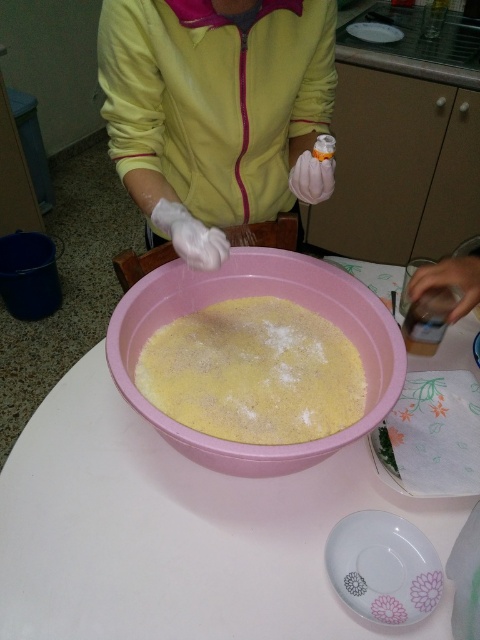
You are trying to place a small plate on the white plastic table at center. However, there is a pink plastic bowl at center in the way. Can you move the plate to the table without disturbing the bowl?

The white plastic table at center is below the pink plastic bowl at center, so you cannot place the plate on the table without moving the bowl first.

You are a food delivery robot with a height of 1.8 meters. You need to pick up an item from the kitchen counter. The porcelain plate at lower center and the white glossy plate at upper center are on the counter. Will your height interfere with reaching both plates?

The distance between the porcelain plate at lower center and the white glossy plate at upper center is 1.79 meters. Since your height is 1.8 meters, your height may interfere slightly, but you should still be able to reach both plates as the distance between them is just under your height.

You are setting up a small kitchen table for a baking activity. You have a white plastic table at center and a pink plastic bowl at center. Which object should you place first to ensure there is enough space for both?

The white plastic table at center is larger in size than the pink plastic bowl at center, so you should place the white plastic table at center first to ensure there is enough space for both.